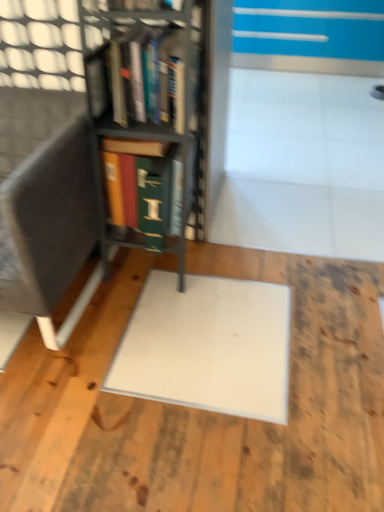
Locate an element on the screen. hardcover books at center, the second book from the bottom is located at coordinates (144, 73).

The height and width of the screenshot is (512, 384). What are the coordinates of `green matte book at center, positioned as the first book in bottom-to-top order` in the screenshot? It's located at (144, 190).

What do you see at coordinates (200, 410) in the screenshot? I see `white matte wood at center` at bounding box center [200, 410].

Find the location of a particular element. The height and width of the screenshot is (512, 384). metallic gray bookcase at center is located at coordinates [165, 100].

Where is `dark gray fabric armchair at left`? dark gray fabric armchair at left is located at coordinates (43, 197).

Where is `hardcover books at center, the second book from the bottom`? hardcover books at center, the second book from the bottom is located at coordinates point(144,73).

Is dark gray fabric armchair at left inside the boundaries of white matte wood at center, or outside?

dark gray fabric armchair at left is not inside white matte wood at center, it's outside.

From the image's perspective, is dark gray fabric armchair at left above or below white matte wood at center?

From the image's perspective, dark gray fabric armchair at left appears above white matte wood at center.

Is the position of dark gray fabric armchair at left less distant than that of white matte wood at center?

No, it is behind white matte wood at center.

In the scene shown: Is white matte wood at center positioned far away from dark gray fabric armchair at left?

That's not correct — white matte wood at center is a little close to dark gray fabric armchair at left.

From a real-world perspective, relative to dark gray fabric armchair at left, is white matte wood at center vertically above or below?

Result: Clearly, from a real-world perspective, white matte wood at center is below dark gray fabric armchair at left.

Does white matte wood at center appear on the right side of dark gray fabric armchair at left?

Indeed, white matte wood at center is positioned on the right side of dark gray fabric armchair at left.

Is white matte wood at center not within dark gray fabric armchair at left?

Indeed, white matte wood at center is completely outside dark gray fabric armchair at left.

From the image's perspective, is white matte wood at center below metallic gray bookcase at center?

Correct, white matte wood at center appears lower than metallic gray bookcase at center in the image.

Considering the sizes of objects white matte wood at center and metallic gray bookcase at center in the image provided, who is shorter, white matte wood at center or metallic gray bookcase at center?

With less height is white matte wood at center.

Is white matte wood at center looking in the opposite direction of metallic gray bookcase at center?

No, white matte wood at center's orientation is not away from metallic gray bookcase at center.

From a real-world perspective, is dark gray fabric armchair at left positioned over metallic gray bookcase at center based on gravity?

Actually, dark gray fabric armchair at left is physically below metallic gray bookcase at center in the real world.

Between point (75, 263) and point (180, 137), which one is positioned behind?

The point (75, 263) is more distant.

Is dark gray fabric armchair at left taller or shorter than metallic gray bookcase at center?

In the image, dark gray fabric armchair at left appears to be shorter than metallic gray bookcase at center.

From the picture: Could you tell me if dark gray fabric armchair at left is facing metallic gray bookcase at center?

No, dark gray fabric armchair at left does not turn towards metallic gray bookcase at center.

Who is shorter, white matte wood at center or green matte book at center, the second book viewed from the top?

white matte wood at center is shorter.

Find the location of a particular element. This screenshot has height=512, width=384. the 1st book above the white matte wood at center (from the image's perspective) is located at coordinates (144, 190).

Is white matte wood at center outside of green matte book at center, the second book viewed from the top?

Yes, white matte wood at center is not within green matte book at center, the second book viewed from the top.

Which object is more forward, white matte wood at center or green matte book at center, the second book viewed from the top?

white matte wood at center is more forward.

From a real-world perspective, is dark gray fabric armchair at left on hardcover books at center, which is the first book in top-to-bottom order?

No, from a real-world perspective, dark gray fabric armchair at left is not over hardcover books at center, which is the first book in top-to-bottom order

Between dark gray fabric armchair at left and hardcover books at center, which is the first book in top-to-bottom order, which one has smaller size?

Smaller between the two is hardcover books at center, which is the first book in top-to-bottom order.

Is hardcover books at center, which is the first book in top-to-bottom order, at the back of dark gray fabric armchair at left?

That's not correct — dark gray fabric armchair at left is not looking away from hardcover books at center, which is the first book in top-to-bottom order.

You are a GUI agent. You are given a task and a screenshot of the screen. Output one action in this format:
    pyautogui.click(x=<x>, y=<y>)
    Task: Click on the armchair in front of the hardcover books at center, which is the first book in top-to-bottom order
    This screenshot has width=384, height=512.
    Given the screenshot: What is the action you would take?
    pyautogui.click(x=43, y=197)

Is hardcover books at center, the second book from the bottom, at the left side of green matte book at center, positioned as the first book in bottom-to-top order?

No, hardcover books at center, the second book from the bottom, is not to the left of green matte book at center, positioned as the first book in bottom-to-top order.

Is hardcover books at center, the second book from the bottom, facing towards green matte book at center, the second book viewed from the top?

No, hardcover books at center, the second book from the bottom, is not turned towards green matte book at center, the second book viewed from the top.

From the image's perspective, is hardcover books at center, which is the first book in top-to-bottom order, above or below green matte book at center, the second book viewed from the top?

Clearly, from the image's perspective, hardcover books at center, which is the first book in top-to-bottom order, is above green matte book at center, the second book viewed from the top.

Does hardcover books at center, the second book from the bottom, have a greater height compared to green matte book at center, positioned as the first book in bottom-to-top order?

No.

Locate an element on the screen. armchair that is behind the white matte wood at center is located at coordinates (43, 197).

At what (x,y) coordinates should I click in order to perform the action: click on wood in front of the dark gray fabric armchair at left. Please return your answer as a coordinate pair (x, y). This screenshot has width=384, height=512. Looking at the image, I should click on (200, 410).

Based on their spatial positions, is metallic gray bookcase at center or hardcover books at center, the second book from the bottom, closer to dark gray fabric armchair at left?

Based on the image, metallic gray bookcase at center appears to be nearer to dark gray fabric armchair at left.

Considering their positions, is white matte wood at center positioned further to metallic gray bookcase at center than hardcover books at center, the second book from the bottom?

Based on the image, white matte wood at center appears to be further to metallic gray bookcase at center.

Which object lies further to the anchor point dark gray fabric armchair at left, hardcover books at center, the second book from the bottom, or green matte book at center, the second book viewed from the top?

Based on the image, hardcover books at center, the second book from the bottom, appears to be further to dark gray fabric armchair at left.

From the image, which object appears to be farther from white matte wood at center, hardcover books at center, which is the first book in top-to-bottom order, or dark gray fabric armchair at left?

hardcover books at center, which is the first book in top-to-bottom order, lies further to white matte wood at center than the other object.

When comparing their distances from white matte wood at center, does green matte book at center, positioned as the first book in bottom-to-top order, or hardcover books at center, which is the first book in top-to-bottom order, seem closer?

Based on the image, green matte book at center, positioned as the first book in bottom-to-top order, appears to be nearer to white matte wood at center.

From the image, which object appears to be farther from white matte wood at center, dark gray fabric armchair at left or green matte book at center, positioned as the first book in bottom-to-top order?

Based on the image, green matte book at center, positioned as the first book in bottom-to-top order, appears to be further to white matte wood at center.

When comparing their distances from metallic gray bookcase at center, does white matte wood at center or dark gray fabric armchair at left seem closer?

The object closer to metallic gray bookcase at center is dark gray fabric armchair at left.

Looking at the image, which one is located further to hardcover books at center, which is the first book in top-to-bottom order, dark gray fabric armchair at left or white matte wood at center?

white matte wood at center.

Where is `armchair between hardcover books at center, which is the first book in top-to-bottom order, and white matte wood at center in the up-down direction`? The image size is (384, 512). armchair between hardcover books at center, which is the first book in top-to-bottom order, and white matte wood at center in the up-down direction is located at coordinates (43, 197).

Locate an element on the screen. The width and height of the screenshot is (384, 512). bookcase between hardcover books at center, the second book from the bottom, and white matte wood at center in the up-down direction is located at coordinates (165, 100).

Locate an element on the screen. Image resolution: width=384 pixels, height=512 pixels. bookcase between dark gray fabric armchair at left and green matte book at center, positioned as the first book in bottom-to-top order, in the horizontal direction is located at coordinates (165, 100).

This screenshot has height=512, width=384. In order to click on book between metallic gray bookcase at center and white matte wood at center from top to bottom in this screenshot , I will do `click(144, 190)`.